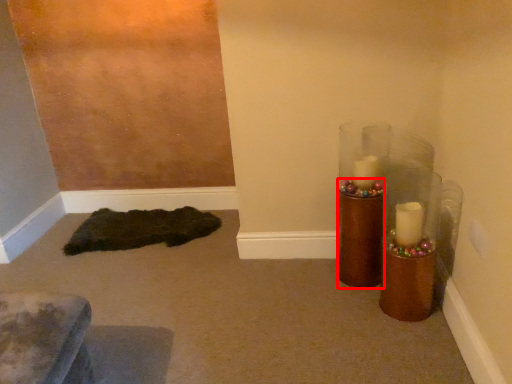
Question: From the image's perspective, where is candle holder (annotated by the red box) located relative to mat?

Choices:
 (A) below
 (B) above

Answer: (B)